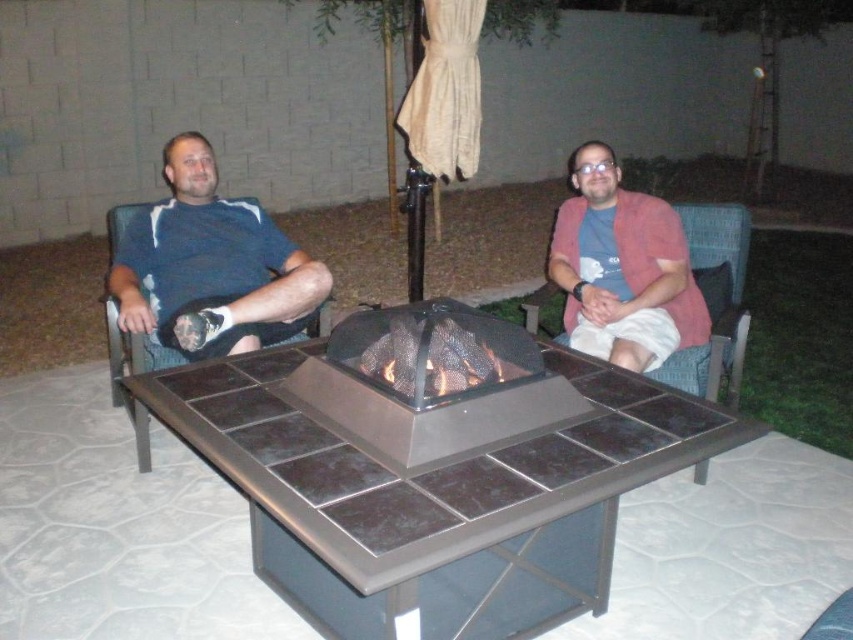
Question: Does metallic slate table at center have a greater width compared to metallic silver fire pit at center?

Choices:
 (A) no
 (B) yes

Answer: (B)

Question: Can you confirm if metallic slate table at center is positioned above matte blue shirt at left?

Choices:
 (A) yes
 (B) no

Answer: (B)

Question: Does metallic silver fire pit at center appear on the right side of blue fabric chair at left?

Choices:
 (A) no
 (B) yes

Answer: (B)

Question: Which point is farther to the camera?

Choices:
 (A) matte blue shirt at left
 (B) dark blue fabric chair at left
 (C) blue fabric chair at left
 (D) woven fabric chair at right

Answer: (A)

Question: Which object is the farthest from the metallic silver fire pit at center?

Choices:
 (A) pink fabric jacket at right
 (B) blue fabric chair at left
 (C) dark blue fabric chair at left
 (D) matte blue shirt at left

Answer: (C)

Question: Estimate the real-world distances between objects in this image. Which object is farther from the blue fabric chair at left?

Choices:
 (A) pink fabric jacket at right
 (B) dark blue fabric chair at left
 (C) metallic slate table at center
 (D) woven fabric chair at right

Answer: (D)